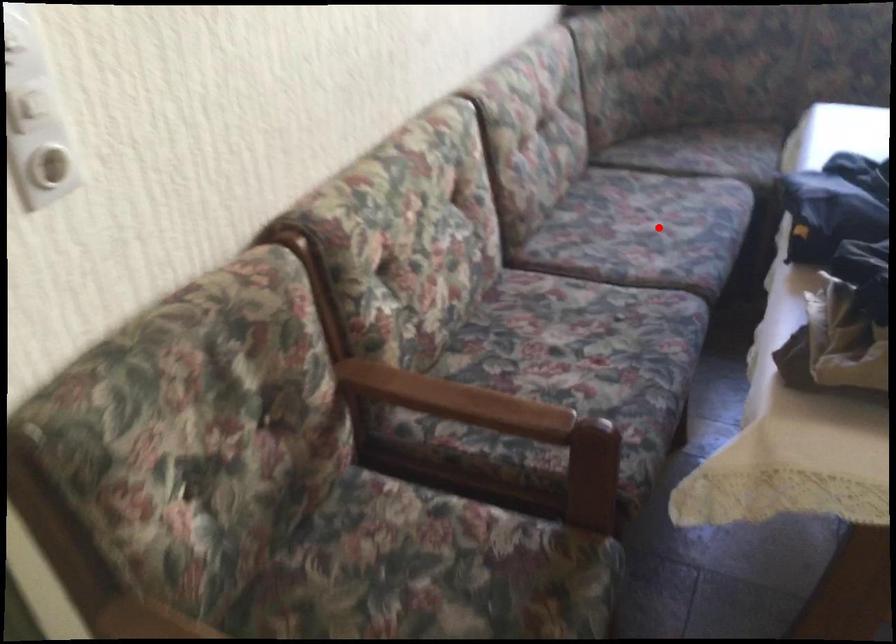
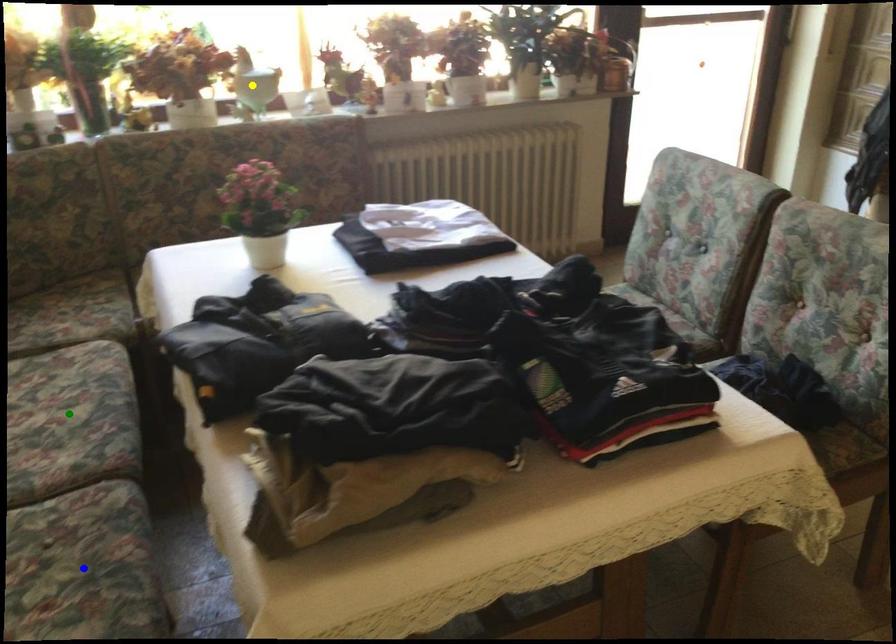
Question: I am providing you with two images of the same scene from different viewpoints. A red point is marked on the first image. You are given multiple points on the second image. Which point in image 2 is actually the same real-world point as the red point in image 1?

Choices:
 (A) yellow point
 (B) green point
 (C) blue point

Answer: (B)